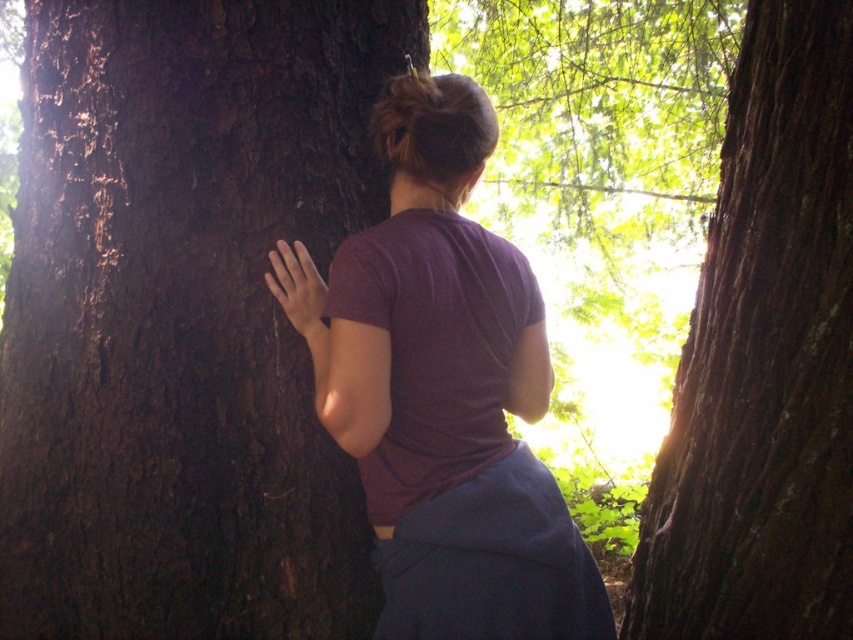
Question: Which object appears farthest from the camera in this image?

Choices:
 (A) dark brown rough tree trunk at center
 (B) purple matte shirt at center

Answer: (B)

Question: Does dark brown rough tree trunk at center come behind purple matte shirt at center?

Choices:
 (A) no
 (B) yes

Answer: (A)

Question: Which is nearer to the purple matte shirt at center?

Choices:
 (A) dark brown rough tree trunk at center
 (B) dark brown rough tree trunk at left

Answer: (B)

Question: Is dark brown rough tree trunk at left below dark brown rough tree trunk at center?

Choices:
 (A) yes
 (B) no

Answer: (B)

Question: Is dark brown rough tree trunk at left further to camera compared to matte brown hand at left?

Choices:
 (A) no
 (B) yes

Answer: (B)

Question: Among these objects, which one is farthest from the camera?

Choices:
 (A) matte brown hand at left
 (B) purple matte shirt at center
 (C) dark brown rough tree trunk at center

Answer: (A)